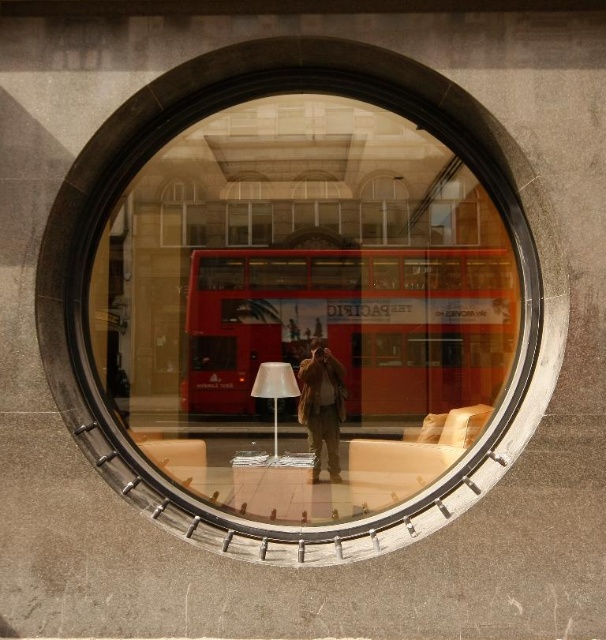
Is transparent glass window at center smaller than brown leather jacket at center?

Incorrect, transparent glass window at center is not smaller in size than brown leather jacket at center.

How distant is transparent glass window at center from brown leather jacket at center?

5.30 meters

Does point (510, 422) come closer to viewer compared to point (316, 438)?

Yes, it is.

Find the location of a particular element. The height and width of the screenshot is (640, 606). transparent glass window at center is located at coordinates (224, 108).

Can you confirm if transparent glass window at center is smaller than red matte bus at center?

Yes, transparent glass window at center is smaller than red matte bus at center.

Which is more to the right, transparent glass window at center or red matte bus at center?

red matte bus at center is more to the right.

Between point (522, 305) and point (385, 390), which one is positioned behind?

Positioned behind is point (385, 390).

Identify the location of transparent glass window at center. This screenshot has width=606, height=640. (224, 108).

Is transparent glass window at center thinner than white matte lamp at center?

No.

Can you confirm if transparent glass window at center is wider than white matte lamp at center?

Indeed, transparent glass window at center has a greater width compared to white matte lamp at center.

Is point (158, 109) less distant than point (281, 392)?

Yes, point (158, 109) is in front of point (281, 392).

The width and height of the screenshot is (606, 640). Find the location of `transparent glass window at center`. transparent glass window at center is located at coordinates (224, 108).